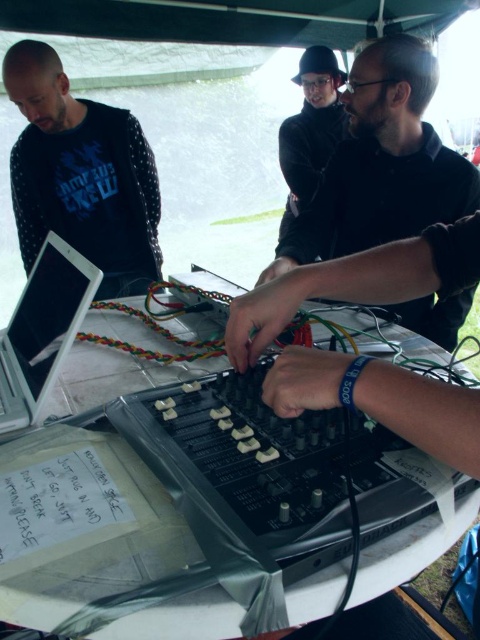
What is located at the coordinate point (81,173) in the image?

The black dotted sweatshirt at upper left is located at the coordinate point (81,173).

You are setting up equipment for a live event and need to place both the black matte headphones at upper center and the white plastic table at center on a stage. Given their sizes, which object will require more space?

The black matte headphones at upper center is bigger than the white plastic table at center, so it will require more space.

You are a sound engineer at a music festival and need to check the audio quality. You have the black matte headphones at upper center and the white glossy laptop at center. Which device should you use to listen to the audio more clearly?

The black matte headphones at upper center has a larger size compared to the white glossy laptop at center, so they are more likely to provide better audio quality for listening purposes.